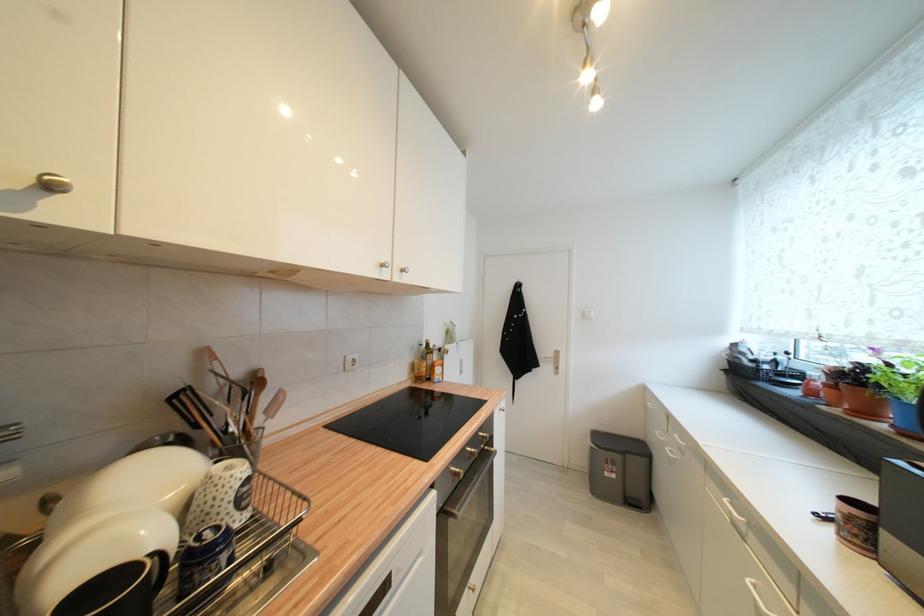
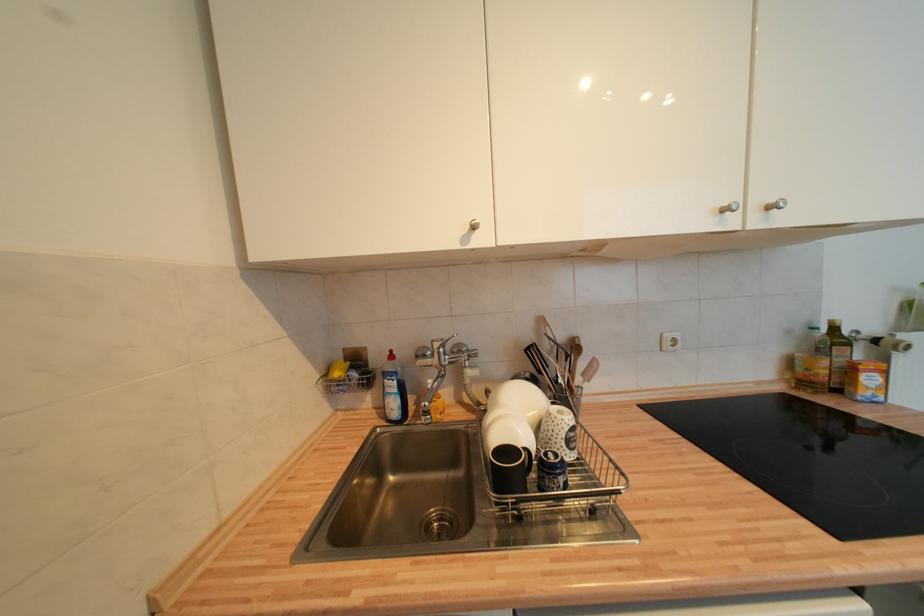
Find the pixel in the second image that matches pixel 393 454 in the first image.

(742, 477)